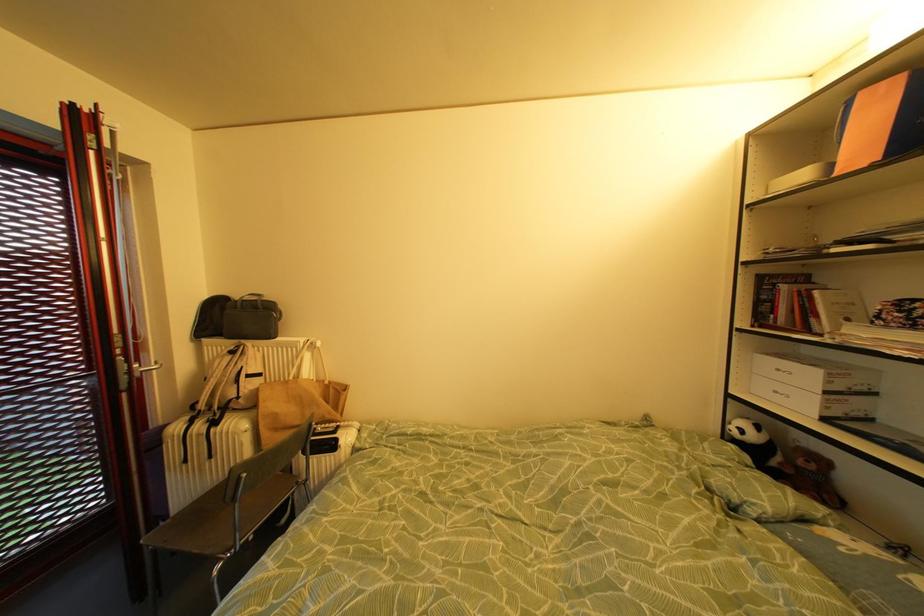
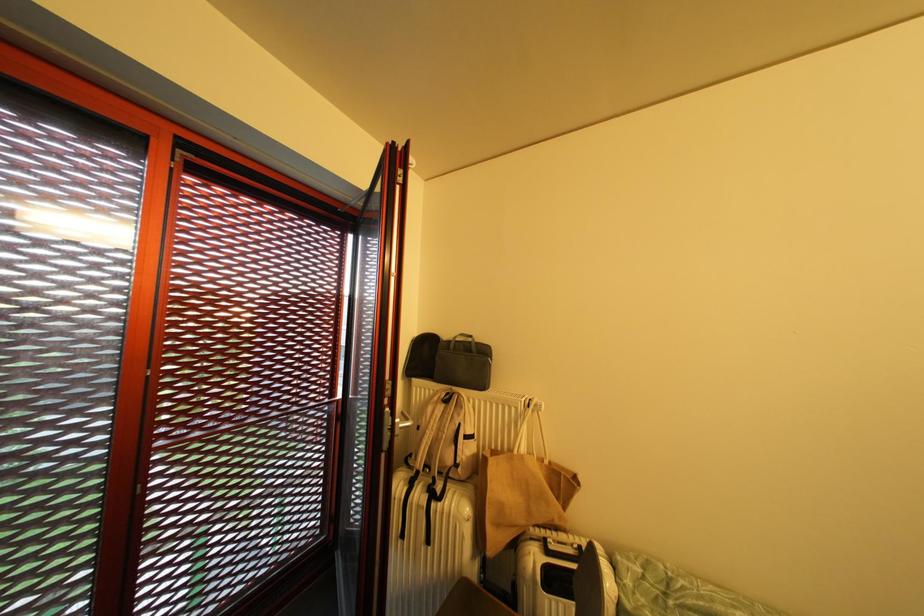
In a continuous first-person perspective shot, in which direction is the camera moving?

The cameraman moved toward left, forward.